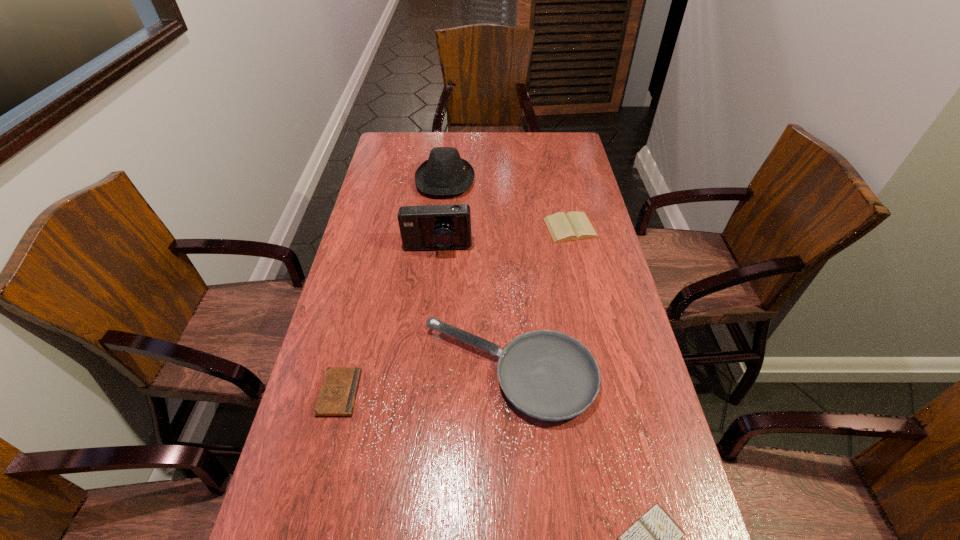
Identify the location of blank space at the far right corner of the desktop. (557, 138).

In order to click on free space between the second tallest object and the leftmost diary in this screenshot , I will do `click(393, 286)`.

Identify the location of vacant region between the second nearest diary and the frying pan. This screenshot has height=540, width=960. (424, 382).

Where is `free space between the fedora and the farthest diary`? This screenshot has height=540, width=960. free space between the fedora and the farthest diary is located at coordinates (508, 204).

Image resolution: width=960 pixels, height=540 pixels. Find the location of `vacant area between the frying pan and the leftmost diary`. vacant area between the frying pan and the leftmost diary is located at coordinates (424, 382).

Locate an element on the screen. The width and height of the screenshot is (960, 540). object that ranks as the fifth closest to the leftmost object is located at coordinates (444, 173).

Where is `object that can be found as the fourth closest to the second nearest diary`? object that can be found as the fourth closest to the second nearest diary is located at coordinates (573, 226).

The image size is (960, 540). Identify the location of diary object that ranks as the closest to the tallest diary. (338, 392).

Find the location of a particular element. This screenshot has height=540, width=960. diary that is the second closest to the second tallest object is located at coordinates (338, 392).

Find the location of a particular element. free space that satisfies the following two spatial constraints: 1. on the front-facing side of the camera; 2. on the spine side of the leftmost diary is located at coordinates (422, 393).